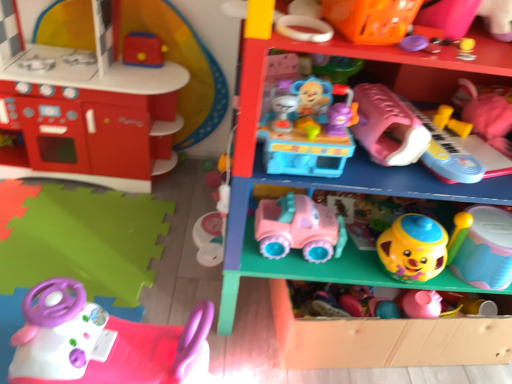
Question: Considering the positions of smooth yellow plastic cup at lower right, which ranks as the second toy in right-to-left order, and purple plastic lid at upper center, which appears as the 6th toy when viewed from the right, in the image, is smooth yellow plastic cup at lower right, which ranks as the second toy in right-to-left order, bigger or smaller than purple plastic lid at upper center, which appears as the 6th toy when viewed from the right,?

Choices:
 (A) small
 (B) big

Answer: (B)

Question: From the image's perspective, relative to purple plastic lid at upper center, which is counted as the sixth toy, starting from the left, is smooth yellow plastic cup at lower right, acting as the 10th toy starting from the left, above or below?

Choices:
 (A) below
 (B) above

Answer: (A)

Question: Which of these objects is positioned closest to the orange plastic basket at upper right, which is the 5th toy in left-to-right order?

Choices:
 (A) pink plastic steering wheel at lower left, marked as the ninth toy in a right-to-left arrangement
 (B) pink rubber car at center, positioned as the fourth toy in left-to-right order
 (C) matte pink car at lower center, which is the 2th shelf from top to bottom
 (D) pink plastic toy car at center, placed as the 1th shelf when sorted from top to bottom
 (E) matte red kitchen set at left, acting as the first toy starting from the left

Answer: (D)

Question: Estimate the real-world distances between objects in this image. Which object is closer to the orange plastic basket at upper right, which is the 5th toy in left-to-right order?

Choices:
 (A) matte pink car at lower center, which is the 2th shelf from top to bottom
 (B) yellow plastic cup at center right, the eighth toy viewed from the left
 (C) rubberized yellow ball at upper right, the seventh toy viewed from the left
 (D) purple plastic lid at upper center, which appears as the 6th toy when viewed from the right
 (E) pink plastic toy car at center, which ranks as the 2th shelf in bottom-to-top order

Answer: (D)